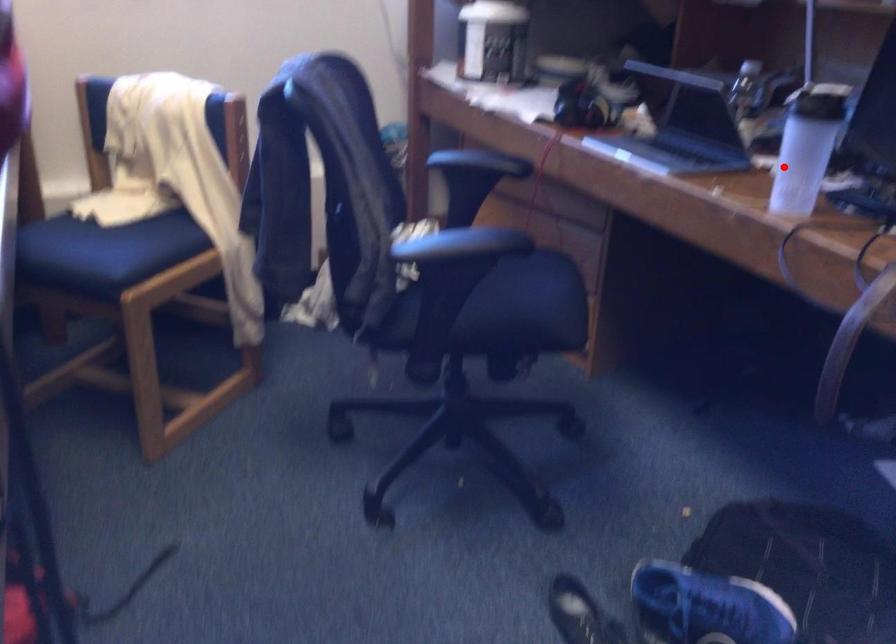
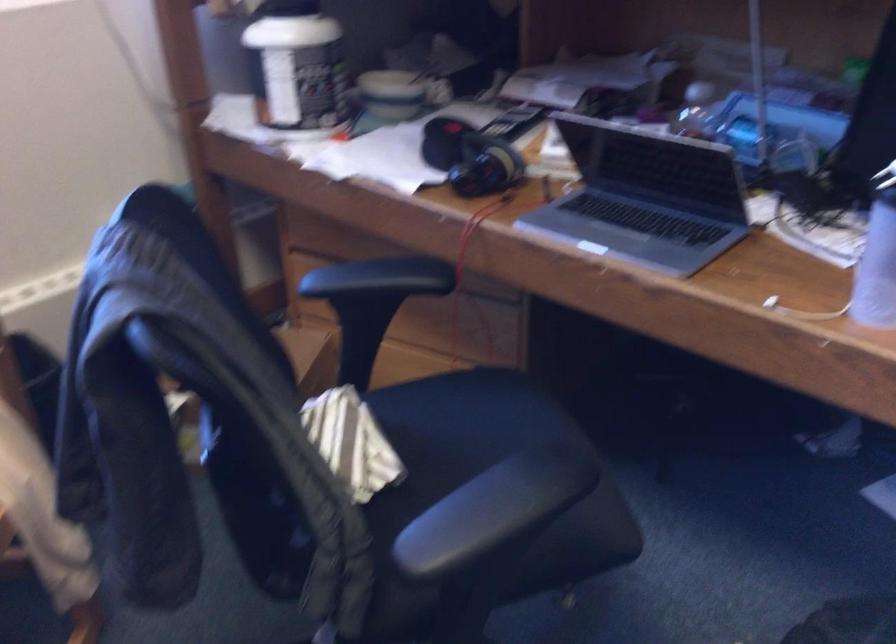
Locate, in the second image, the point that corresponds to the highlighted location in the first image.

(876, 268)